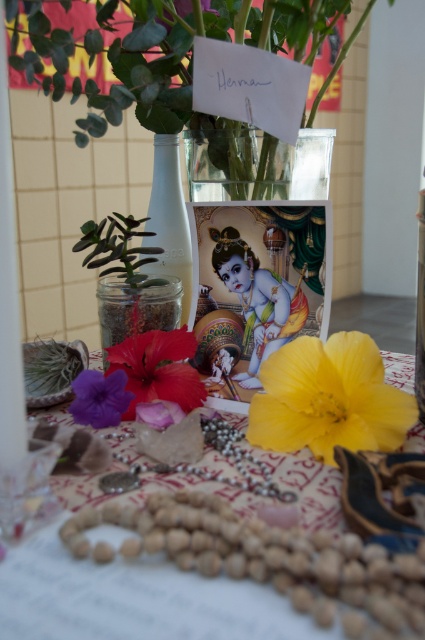
You are standing 10 inches away from the altar. Can you reach the point at coordinates point (158, 428) without moving closer?

The distance of point (158, 428) from camera is 11.23 inches, so you are 10 inches away and need to move 1.23 inches closer to reach it.

You are an altar attendant who needs to place a new offering between the yellow matte flower at center and the vivid red petal at center. Based on their positions, which side should you place it on to ensure it is between them?

The yellow matte flower at center is to the right of the vivid red petal at center, so placing the offering between them would require positioning it to the left of the yellow matte flower at center and to the right of the vivid red petal at center.

You are standing in front of the altar and want to place a small offering between the pink matte flower at center and the green leafy plant at upper left. Which object should you move closer to you to make space?

The pink matte flower at center is closer to the viewer than the green leafy plant at upper left. To make space, you should move the pink matte flower at center slightly backward to create room between them.